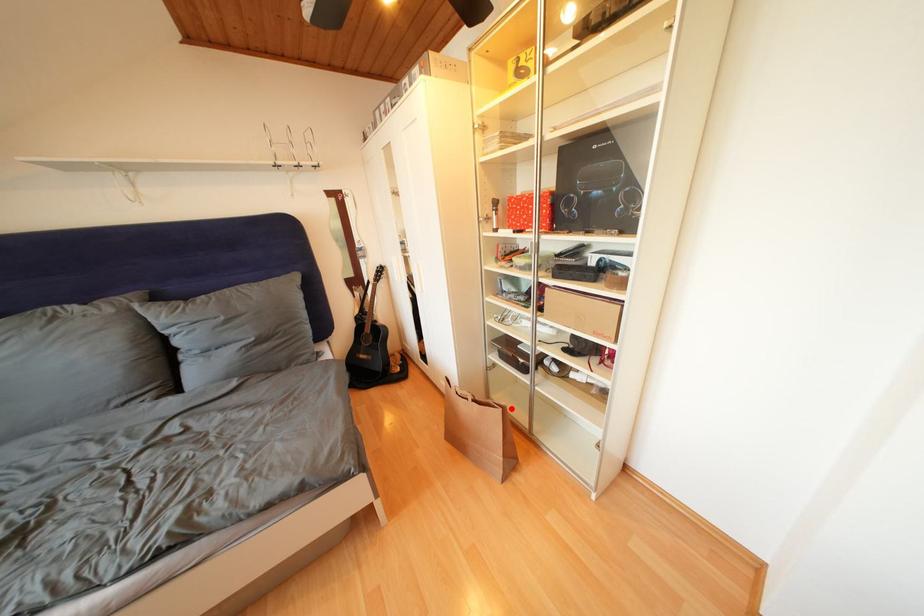
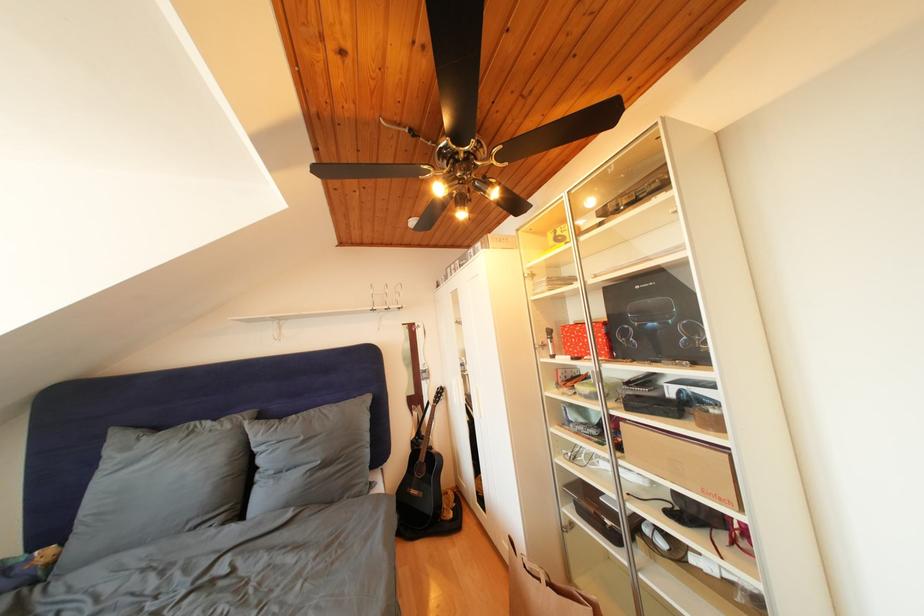
Locate, in the second image, the point that corresponds to the highlighted location in the first image.

(602, 602)